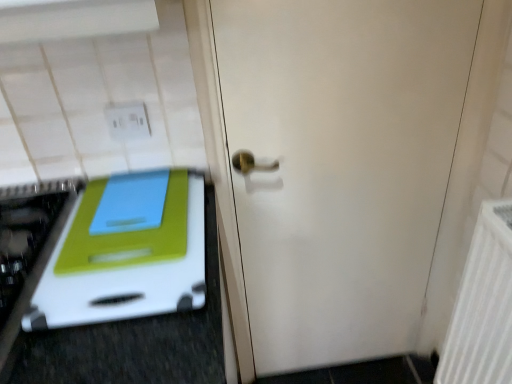
Describe the element at coordinates (483, 305) in the screenshot. I see `white textured radiator at right` at that location.

In order to face white plastic cutting board at left, should I rotate leftwards or rightwards?

It's best to rotate left around 15.756 degrees.

What do you see at coordinates (126, 252) in the screenshot? Image resolution: width=512 pixels, height=384 pixels. I see `white plastic cutting board at left` at bounding box center [126, 252].

What is the approximate width of white plastic electric outlet at upper left?

The width of white plastic electric outlet at upper left is 0.86 inches.

Locate an element on the screen. white textured radiator at right is located at coordinates (483, 305).

Are white matte door at center and white plastic cutting board at left located far from each other?

white matte door at center is near white plastic cutting board at left, not far away.

Considering the relative sizes of white matte door at center and white plastic cutting board at left in the image provided, is white matte door at center bigger than white plastic cutting board at left?

Correct, white matte door at center is larger in size than white plastic cutting board at left.

Based on the photo, considering the relative sizes of white matte door at center and white plastic cutting board at left in the image provided, is white matte door at center taller than white plastic cutting board at left?

Indeed, white matte door at center has a greater height compared to white plastic cutting board at left.

How much distance is there between white matte door at center and white plastic cutting board at left?

17.54 inches.

Does point (456, 328) appear closer or farther from the camera than point (455, 144)?

Point (456, 328) is closer to the camera than point (455, 144).

Considering the relative positions of white textured radiator at right and white matte door at center in the image provided, is white textured radiator at right in front of white matte door at center?

Yes, white textured radiator at right is closer to the viewer.

Would you say white matte door at center is part of white textured radiator at right's contents?

No, white matte door at center is not surrounded by white textured radiator at right.

Considering the relative sizes of white textured radiator at right and white matte door at center in the image provided, is white textured radiator at right shorter than white matte door at center?

Correct, white textured radiator at right is not as tall as white matte door at center.

From a real-world perspective, is white matte door at center positioned above or below white plastic electric outlet at upper left?

white matte door at center is situated lower than white plastic electric outlet at upper left in the real world.

Can we say white matte door at center lies outside white plastic electric outlet at upper left?

white matte door at center lies outside white plastic electric outlet at upper left's area.

Is white matte door at center aimed at white plastic electric outlet at upper left?

No, white matte door at center is not oriented towards white plastic electric outlet at upper left.

I want to click on door that appears in front of the white plastic electric outlet at upper left, so pyautogui.click(x=340, y=165).

In the scene shown: Would you say white plastic electric outlet at upper left contains white plastic cutting board at left?

Definitely not — white plastic cutting board at left is not inside white plastic electric outlet at upper left.

From a real-world perspective, which is physically below, white plastic electric outlet at upper left or white plastic cutting board at left?

white plastic cutting board at left, from a real-world perspective.

Does white plastic electric outlet at upper left have a greater width compared to white plastic cutting board at left?

Incorrect, the width of white plastic electric outlet at upper left does not surpass that of white plastic cutting board at left.

Considering the relative sizes of white textured radiator at right and white plastic cutting board at left in the image provided, is white textured radiator at right shorter than white plastic cutting board at left?

No, white textured radiator at right is not shorter than white plastic cutting board at left.

From the image's perspective, which is above, white textured radiator at right or white plastic cutting board at left?

white plastic cutting board at left, from the image's perspective.

Is white textured radiator at right aimed at white plastic cutting board at left?

Yes, white textured radiator at right is turned towards white plastic cutting board at left.

Can you confirm if white plastic cutting board at left is smaller than white textured radiator at right?

Yes, white plastic cutting board at left is smaller than white textured radiator at right.

Can you tell me how much white plastic cutting board at left and white textured radiator at right differ in facing direction?

There is a 90.7-degree angle between the facing directions of white plastic cutting board at left and white textured radiator at right.

From the picture: From a real-world perspective, which is physically above, white plastic cutting board at left or white textured radiator at right?

In real-world perspective, white plastic cutting board at left is above.

Is white plastic cutting board at left outside of white matte door at center?

white plastic cutting board at left is positioned outside white matte door at center.

From a real-world perspective, which is physically above, white plastic cutting board at left or white matte door at center?

From a 3D spatial view, white plastic cutting board at left is above.

Does point (127, 285) appear closer or farther from the camera than point (394, 310)?

Point (127, 285) appears to be closer to the viewer than point (394, 310).

Locate an element on the screen. door located below the white plastic cutting board at left (from the image's perspective) is located at coordinates [340, 165].

Locate an element on the screen. Image resolution: width=512 pixels, height=384 pixels. radiator that is in front of the white matte door at center is located at coordinates (483, 305).

Looking at the image, which one is located further to white matte door at center, white plastic cutting board at left or white plastic electric outlet at upper left?

white plastic electric outlet at upper left is positioned further to the anchor white matte door at center.

Estimate the real-world distances between objects in this image. Which object is further from white matte door at center, white plastic cutting board at left or white textured radiator at right?

white plastic cutting board at left is further to white matte door at center.

From the image, which object appears to be nearer to white plastic electric outlet at upper left, white matte door at center or white textured radiator at right?

white matte door at center lies closer to white plastic electric outlet at upper left than the other object.

Based on their spatial positions, is white plastic cutting board at left or white plastic electric outlet at upper left further from white textured radiator at right?

white plastic electric outlet at upper left.

When comparing their distances from white matte door at center, does white plastic electric outlet at upper left or white plastic cutting board at left seem further?

Based on the image, white plastic electric outlet at upper left appears to be further to white matte door at center.

Based on their spatial positions, is white plastic cutting board at left or white matte door at center further from white plastic electric outlet at upper left?

Based on the image, white matte door at center appears to be further to white plastic electric outlet at upper left.

From the image, which object appears to be nearer to white textured radiator at right, white plastic electric outlet at upper left or white matte door at center?

Based on the image, white matte door at center appears to be nearer to white textured radiator at right.

Considering their positions, is white textured radiator at right positioned closer to white matte door at center than white plastic electric outlet at upper left?

Among the two, white textured radiator at right is located nearer to white matte door at center.

Identify the location of door between white plastic electric outlet at upper left and white textured radiator at right in the horizontal direction. (340, 165).

Image resolution: width=512 pixels, height=384 pixels. I want to click on oven between white plastic electric outlet at upper left and white matte door at center, so click(126, 252).

Image resolution: width=512 pixels, height=384 pixels. In order to click on oven located between white plastic electric outlet at upper left and white textured radiator at right in the left-right direction in this screenshot , I will do `click(126, 252)`.

The width and height of the screenshot is (512, 384). What are the coordinates of `door between white plastic cutting board at left and white textured radiator at right in the horizontal direction` in the screenshot? It's located at (340, 165).